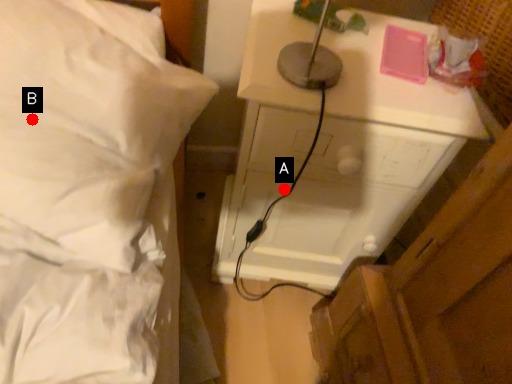
Question: Two points are circled on the image, labeled by A and B beside each circle. Among these points, which one is nearest to the camera?

Choices:
 (A) A is closer
 (B) B is closer

Answer: (B)